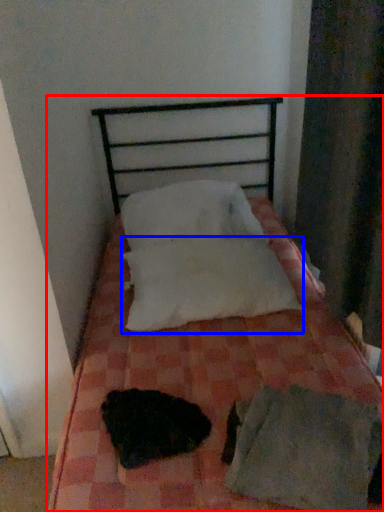
Question: Which object appears closest to the camera in this image, bed (highlighted by a red box) or pillow (highlighted by a blue box)?

Choices:
 (A) bed
 (B) pillow

Answer: (A)